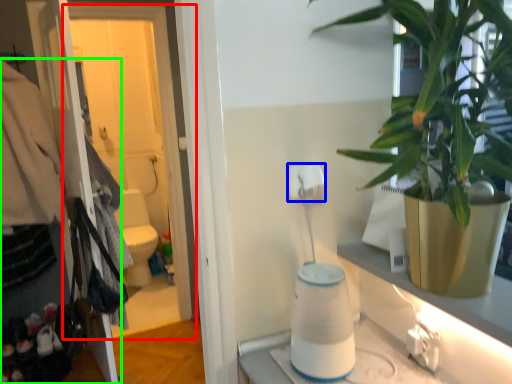
Question: Considering the real-world distances, which object is closest to screen door (highlighted by a red box)? toilet paper (highlighted by a blue box) or closet (highlighted by a green box).

Choices:
 (A) toilet paper
 (B) closet

Answer: (B)